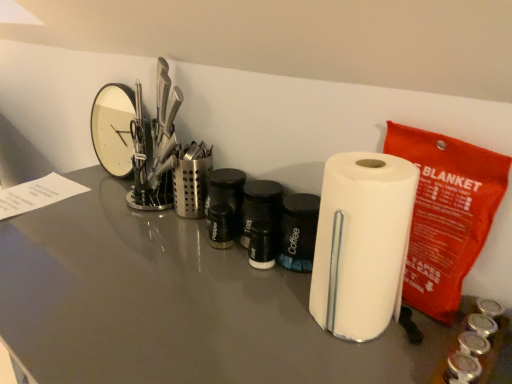
At what (x,y) coordinates should I click in order to perform the action: click on empty space that is in between white matte paper towel at center and white paper towel at right, the 2th stationery when ordered from back to front. Please return your answer as a coordinate pair (x, y). Looking at the image, I should click on click(x=412, y=341).